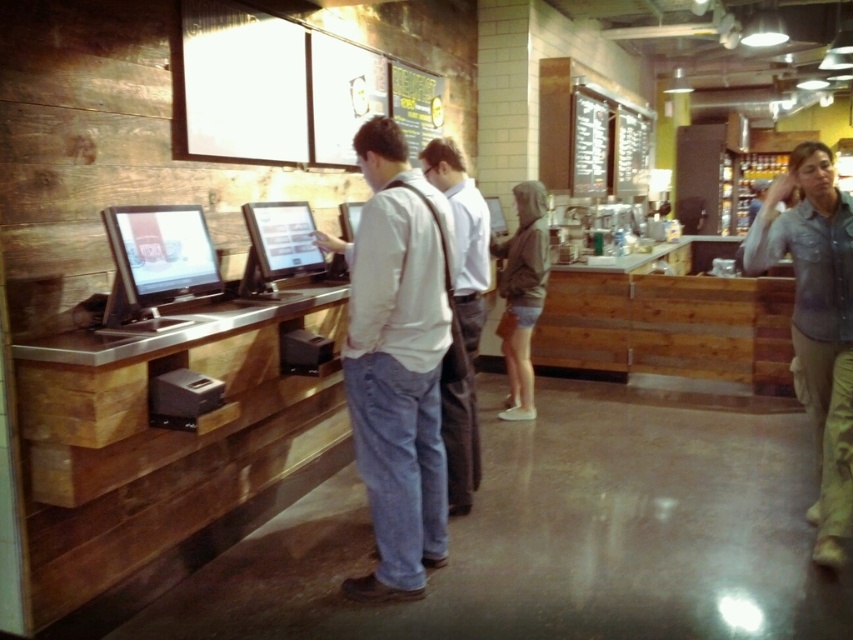
Between denim shirt at center and white shirt at center, which one appears on the left side from the viewer's perspective?

From the viewer's perspective, white shirt at center appears more on the left side.

Does point (842, 448) come behind point (445, 433)?

No.

The height and width of the screenshot is (640, 853). I want to click on denim shirt at center, so click(816, 323).

Does denim shirt at center come behind matte black monitor at center?

No.

Who is positioned more to the right, denim shirt at center or matte black monitor at center?

Positioned to the right is denim shirt at center.

Who is more distant from viewer, [798,276] or [358,220]?

Positioned behind is point [358,220].

Where is `denim shirt at center`? The height and width of the screenshot is (640, 853). denim shirt at center is located at coordinates (816, 323).

Does dark green hoodie at center have a smaller size compared to matte black monitor at center?

No, dark green hoodie at center is not smaller than matte black monitor at center.

Which is in front, point (517, 346) or point (351, 227)?

Point (351, 227) is in front.

Does point (503, 417) lie behind point (354, 230)?

Yes, point (503, 417) is farther from viewer.

This screenshot has height=640, width=853. Find the location of `dark green hoodie at center`. dark green hoodie at center is located at coordinates (521, 294).